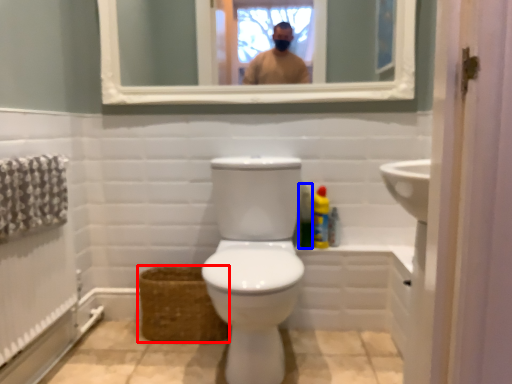
Question: Which of the following is the farthest to the observer, basket (highlighted by a red box) or cleaning product (highlighted by a blue box)?

Choices:
 (A) basket
 (B) cleaning product

Answer: (B)